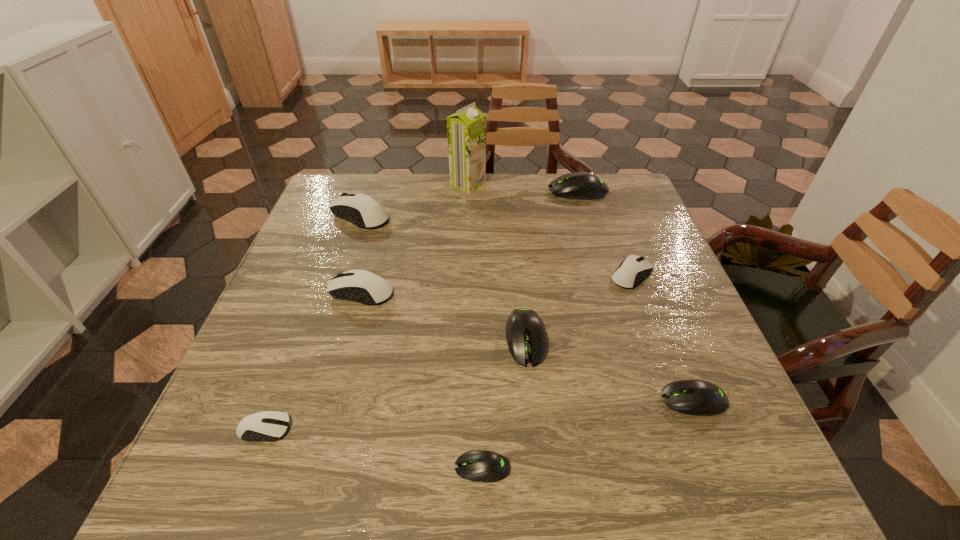
At what (x,y) coordinates should I click in order to perform the action: click on free location located on the wheel side of the fifth computer mouse from right to left. Please return your answer as a coordinate pair (x, y). Looking at the image, I should click on (363, 468).

You are a GUI agent. You are given a task and a screenshot of the screen. Output one action in this format:
    pyautogui.click(x=<x>, y=<y>)
    Task: Click on the soya milk present at the far edge
    This screenshot has height=540, width=960.
    Given the screenshot: What is the action you would take?
    [466, 129]

This screenshot has width=960, height=540. I want to click on object situated at the near edge, so click(484, 466).

At what (x,y) coordinates should I click in order to perform the action: click on object that is positioned at the far left corner. Please return your answer as a coordinate pair (x, y). Looking at the image, I should click on (360, 209).

Where is `object that is positioned at the far right corner`? Image resolution: width=960 pixels, height=540 pixels. object that is positioned at the far right corner is located at coordinates pyautogui.click(x=579, y=185).

I want to click on vacant space at the far edge of the desktop, so click(x=413, y=192).

Where is `vacant space at the near edge`? vacant space at the near edge is located at coordinates (308, 486).

Find the location of `free space at the left edge`. free space at the left edge is located at coordinates (309, 261).

The height and width of the screenshot is (540, 960). I want to click on blank space at the right edge of the desktop, so click(x=604, y=233).

Identify the location of vacant region at the far right corner of the desktop. point(634,213).